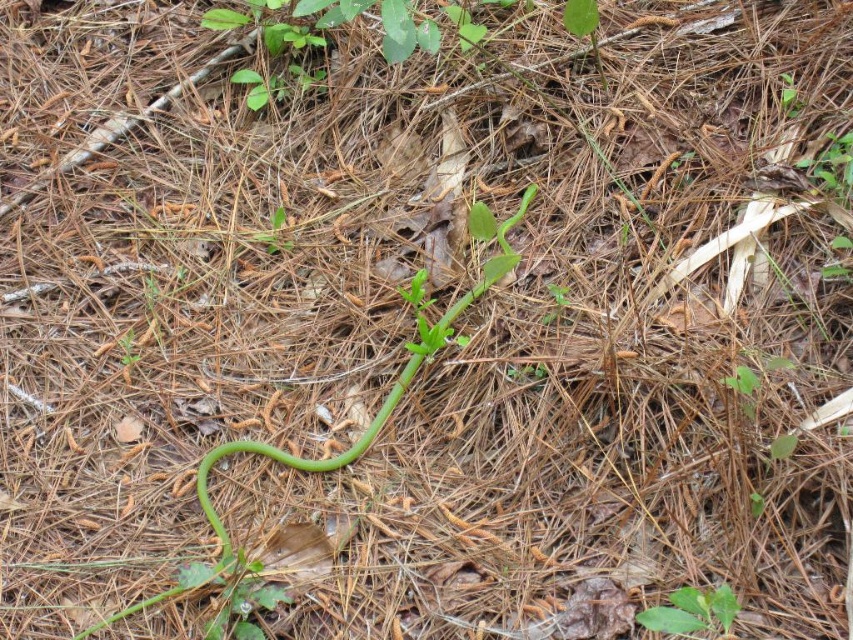
Question: Can you confirm if green glossy snake at center is positioned above green matte leaf at center?

Choices:
 (A) yes
 (B) no

Answer: (A)

Question: From the image, what is the correct spatial relationship of green glossy snake at center in relation to green matte leaf at center?

Choices:
 (A) below
 (B) above

Answer: (B)

Question: Is the position of green glossy snake at center more distant than that of green matte leaf at center?

Choices:
 (A) no
 (B) yes

Answer: (B)

Question: Which point is closer to the camera taking this photo?

Choices:
 (A) (669, 627)
 (B) (225, 598)

Answer: (A)

Question: Which point is closer to the camera?

Choices:
 (A) green glossy snake at center
 (B) green matte leaf at center

Answer: (B)

Question: Which object appears closest to the camera in this image?

Choices:
 (A) green matte leaf at center
 (B) green glossy snake at center

Answer: (A)